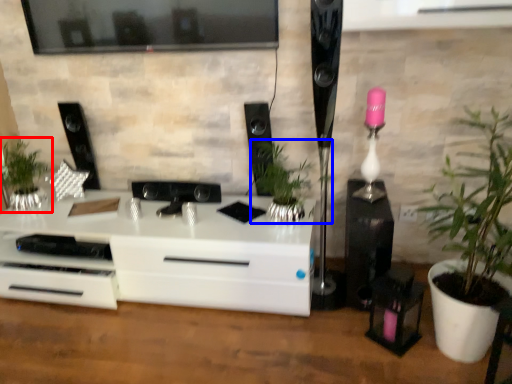
Question: Among these objects, which one is nearest to the camera, houseplant (highlighted by a red box) or houseplant (highlighted by a blue box)?

Choices:
 (A) houseplant
 (B) houseplant

Answer: (B)